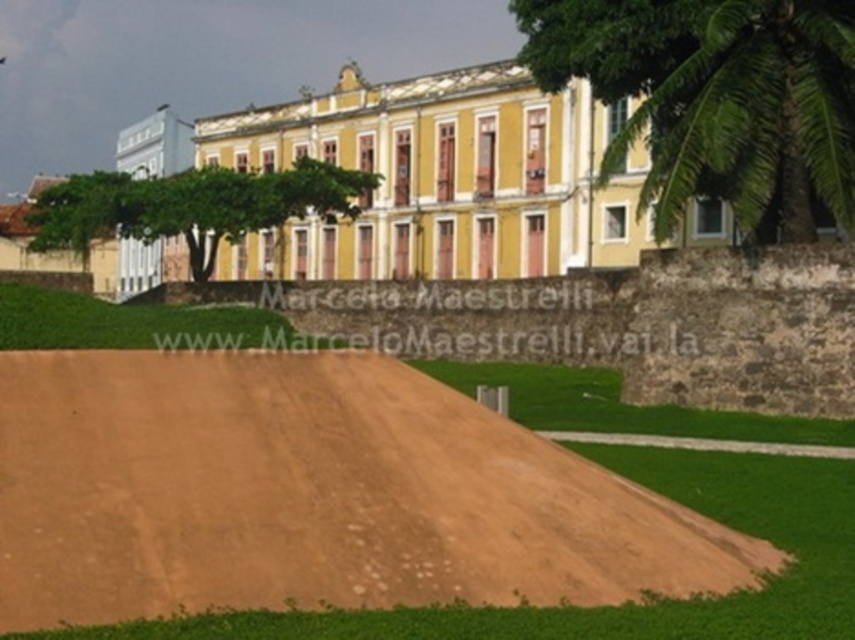
Question: Which point is farther to the camera?

Choices:
 (A) brown sandy dirt at center
 (B) green leafy palm tree at upper center

Answer: (B)

Question: Considering the relative positions of brown sandy dirt at center and green leafy palm tree at upper center in the image provided, where is brown sandy dirt at center located with respect to green leafy palm tree at upper center?

Choices:
 (A) right
 (B) left

Answer: (B)

Question: Which object appears closest to the camera in this image?

Choices:
 (A) green leafy palm tree at upper center
 (B) brown sandy dirt at center

Answer: (B)

Question: Can you confirm if brown sandy dirt at center is positioned to the right of green leafy palm tree at upper center?

Choices:
 (A) no
 (B) yes

Answer: (A)

Question: Does brown sandy dirt at center appear over green leafy palm tree at upper center?

Choices:
 (A) yes
 (B) no

Answer: (B)

Question: Which of the following is the farthest from the observer?

Choices:
 (A) (428, 544)
 (B) (814, 230)

Answer: (B)